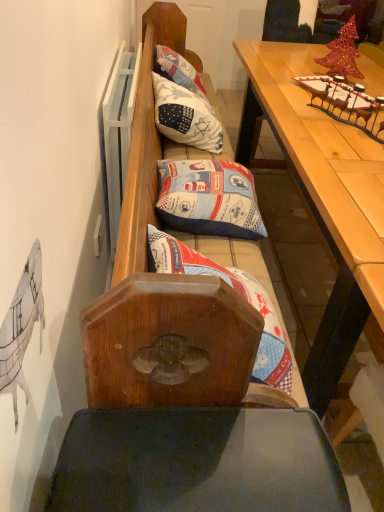
What is the approximate width of printed fabric pillow at center, arranged as the 3th pillow when viewed from the top?

It is 43.63 centimeters.

At what (x,y) coordinates should I click in order to perform the action: click on wooden table at upper right. Please return your answer as a coordinate pair (x, y). Looking at the image, I should click on (316, 206).

Can you see white fabric pillow at center, the 1th pillow from the top, touching wooden table at upper right?

They are not placed beside each other.

Would you say white fabric pillow at center, the 1th pillow from the top, is to the left or to the right of wooden table at upper right in the picture?

Based on their positions, white fabric pillow at center, the 1th pillow from the top, is located to the left of wooden table at upper right.

How many degrees apart are the facing directions of white fabric pillow at center, positioned as the third pillow in front-to-back order, and wooden table at upper right?

They differ by 7.04 degrees in their facing directions.

Find the location of a particular element. This screenshot has height=512, width=384. table in front of the white fabric pillow at center, the first pillow viewed from the back is located at coordinates (316, 206).

Does wooden table at upper right have a lesser width compared to blue fabric pillow at center, which is the second pillow in back-to-front order?

Incorrect, the width of wooden table at upper right is not less than that of blue fabric pillow at center, which is the second pillow in back-to-front order.

Where is `the 1st pillow positioned above the wooden table at upper right (from a real-world perspective)`? the 1st pillow positioned above the wooden table at upper right (from a real-world perspective) is located at coordinates (209, 199).

Considering the relative sizes of wooden table at upper right and blue fabric pillow at center, the second pillow when ordered from top to bottom, in the image provided, is wooden table at upper right bigger than blue fabric pillow at center, the second pillow when ordered from top to bottom,?

Yes.

Is wooden table at upper right facing towards blue fabric pillow at center, which appears as the second pillow when viewed from the front?

Yes, wooden table at upper right is turned towards blue fabric pillow at center, which appears as the second pillow when viewed from the front.

Looking at this image, from the image's perspective, is wooden table at upper right positioned above or below white fabric pillow at center, the 3th pillow ordered from the bottom?

Clearly, from the image's perspective, wooden table at upper right is below white fabric pillow at center, the 3th pillow ordered from the bottom.

Looking at their sizes, would you say wooden table at upper right is wider or thinner than white fabric pillow at center, the 1th pillow from the top?

Considering their sizes, wooden table at upper right looks broader than white fabric pillow at center, the 1th pillow from the top.

Is wooden table at upper right not inside white fabric pillow at center, the 1th pillow from the top?

Yes.

The height and width of the screenshot is (512, 384). I want to click on pillow that appears above the wooden table at upper right (from the image's perspective), so click(186, 116).

Is wooden table at upper right directly adjacent to printed fabric pillow at center, which is the 1th pillow from bottom to top?

wooden table at upper right and printed fabric pillow at center, which is the 1th pillow from bottom to top, are not in contact.

Which is in front, point (357, 298) or point (265, 338)?

The point (265, 338) is more forward.

Is wooden table at upper right positioned beyond the bounds of printed fabric pillow at center, which is the 1th pillow from bottom to top?

wooden table at upper right lies outside printed fabric pillow at center, which is the 1th pillow from bottom to top,'s area.

Relative to printed fabric pillow at center, which is counted as the 1th pillow, starting from the front, is wooden table at upper right in front or behind?

wooden table at upper right is in front of printed fabric pillow at center, which is counted as the 1th pillow, starting from the front.

Is printed fabric pillow at center, which is the 1th pillow from bottom to top, not near white fabric pillow at center, the first pillow viewed from the back?

Yes, printed fabric pillow at center, which is the 1th pillow from bottom to top, and white fabric pillow at center, the first pillow viewed from the back, are located far from each other.

Is printed fabric pillow at center, arranged as the 3th pillow when viewed from the top, oriented towards white fabric pillow at center, the 1th pillow from the top?

No, printed fabric pillow at center, arranged as the 3th pillow when viewed from the top, is not turned towards white fabric pillow at center, the 1th pillow from the top.

Which of these two, printed fabric pillow at center, arranged as the 3th pillow when viewed from the top, or white fabric pillow at center, the 3th pillow ordered from the bottom, is wider?

printed fabric pillow at center, arranged as the 3th pillow when viewed from the top, is wider.

Is printed fabric pillow at center, arranged as the 3th pillow when viewed from the top, shorter than white fabric pillow at center, positioned as the third pillow in front-to-back order?

Correct, printed fabric pillow at center, arranged as the 3th pillow when viewed from the top, is not as tall as white fabric pillow at center, positioned as the third pillow in front-to-back order.

What are the coordinates of `table in front of the printed fabric pillow at center, which appears as the 3th pillow when viewed from the back` in the screenshot? It's located at (316, 206).

Between point (174, 271) and point (306, 106), which one is positioned behind?

The point (306, 106) is more distant.

Is printed fabric pillow at center, arranged as the 3th pillow when viewed from the top, shorter than wooden table at upper right?

Yes.

Is point (180, 199) positioned behind point (231, 278)?

That is True.

Is blue fabric pillow at center, placed as the 2th pillow when sorted from bottom to top, looking in the opposite direction of printed fabric pillow at center, which appears as the 3th pillow when viewed from the back?

blue fabric pillow at center, placed as the 2th pillow when sorted from bottom to top, is not turned away from printed fabric pillow at center, which appears as the 3th pillow when viewed from the back.

Is blue fabric pillow at center, which appears as the second pillow when viewed from the front, completely or partially outside of printed fabric pillow at center, which appears as the 3th pillow when viewed from the back?

Yes, blue fabric pillow at center, which appears as the second pillow when viewed from the front, is located beyond the bounds of printed fabric pillow at center, which appears as the 3th pillow when viewed from the back.

From the image's perspective, is blue fabric pillow at center, placed as the 2th pillow when sorted from bottom to top, above or below printed fabric pillow at center, which is the 1th pillow from bottom to top?

blue fabric pillow at center, placed as the 2th pillow when sorted from bottom to top, is above printed fabric pillow at center, which is the 1th pillow from bottom to top.

At what (x,y) coordinates should I click in order to perform the action: click on table that is in front of the white fabric pillow at center, the 3th pillow ordered from the bottom. Please return your answer as a coordinate pair (x, y). Looking at the image, I should click on (316, 206).

At what (x,y) coordinates should I click in order to perform the action: click on table on the right side of blue fabric pillow at center, which is the second pillow in back-to-front order. Please return your answer as a coordinate pair (x, y). The height and width of the screenshot is (512, 384). Looking at the image, I should click on (316, 206).

Estimate the real-world distances between objects in this image. Which object is further from white fabric pillow at center, positioned as the third pillow in front-to-back order, blue fabric pillow at center, the second pillow when ordered from top to bottom, or printed fabric pillow at center, which is the 1th pillow from bottom to top?

Among the two, printed fabric pillow at center, which is the 1th pillow from bottom to top, is located further to white fabric pillow at center, positioned as the third pillow in front-to-back order.

Estimate the real-world distances between objects in this image. Which object is further from printed fabric pillow at center, which is the 1th pillow from bottom to top, blue fabric pillow at center, which appears as the second pillow when viewed from the front, or wooden table at upper right?

wooden table at upper right is further to printed fabric pillow at center, which is the 1th pillow from bottom to top.

Based on the photo, looking at the image, which one is located further to wooden table at upper right, white fabric pillow at center, the 1th pillow from the top, or blue fabric pillow at center, placed as the 2th pillow when sorted from bottom to top?

white fabric pillow at center, the 1th pillow from the top, lies further to wooden table at upper right than the other object.

Considering their positions, is white fabric pillow at center, the first pillow viewed from the back, positioned closer to wooden table at upper right than printed fabric pillow at center, which appears as the 3th pillow when viewed from the back?

Among the two, white fabric pillow at center, the first pillow viewed from the back, is located nearer to wooden table at upper right.

Which object lies nearer to the anchor point white fabric pillow at center, the 1th pillow from the top, printed fabric pillow at center, arranged as the 3th pillow when viewed from the top, or wooden table at upper right?

wooden table at upper right is closer to white fabric pillow at center, the 1th pillow from the top.

Based on their spatial positions, is printed fabric pillow at center, which appears as the 3th pillow when viewed from the back, or white fabric pillow at center, the 1th pillow from the top, further from wooden table at upper right?

Based on the image, printed fabric pillow at center, which appears as the 3th pillow when viewed from the back, appears to be further to wooden table at upper right.

Looking at the image, which one is located closer to printed fabric pillow at center, which appears as the 3th pillow when viewed from the back, white fabric pillow at center, the 3th pillow ordered from the bottom, or wooden table at upper right?

wooden table at upper right.

Looking at the image, which one is located further to printed fabric pillow at center, arranged as the 3th pillow when viewed from the top, wooden table at upper right or white fabric pillow at center, the 1th pillow from the top?

white fabric pillow at center, the 1th pillow from the top, is further to printed fabric pillow at center, arranged as the 3th pillow when viewed from the top.

The width and height of the screenshot is (384, 512). I want to click on pillow positioned between printed fabric pillow at center, which is the 1th pillow from bottom to top, and white fabric pillow at center, the first pillow viewed from the back, from near to far, so click(209, 199).

At what (x,y) coordinates should I click in order to perform the action: click on pillow between blue fabric pillow at center, placed as the 2th pillow when sorted from bottom to top, and wooden table at upper right, in the horizontal direction. Please return your answer as a coordinate pair (x, y). The image size is (384, 512). Looking at the image, I should click on (238, 293).